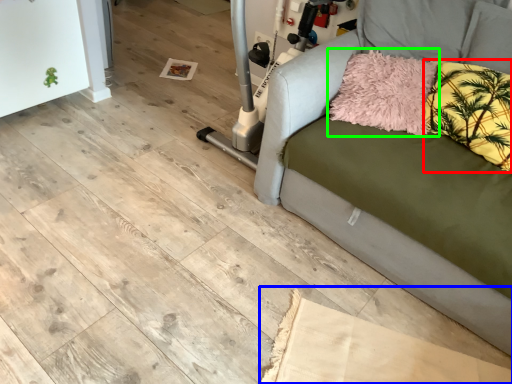
Question: Which is nearer to the pillow (highlighted by a red box)? cardboard (highlighted by a blue box) or pillow (highlighted by a green box).

Choices:
 (A) cardboard
 (B) pillow

Answer: (B)